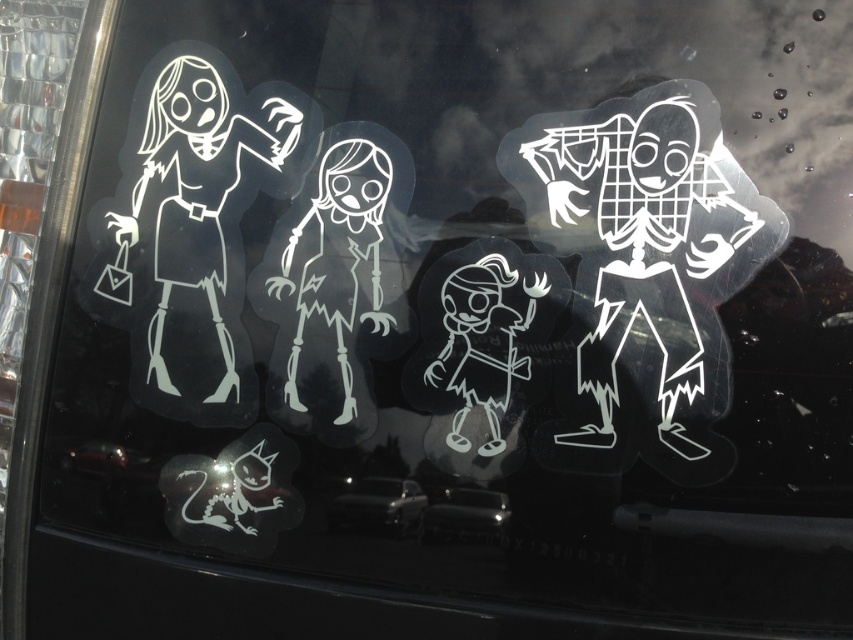
Between transparent plastic figure at right and transparent plastic car at lower center, which one is positioned lower?

Positioned lower is transparent plastic car at lower center.

What do you see at coordinates (646, 264) in the screenshot? I see `transparent plastic figure at right` at bounding box center [646, 264].

Between point (772, 234) and point (380, 477), which one is positioned behind?

The point (380, 477) is more distant.

I want to click on transparent plastic figure at right, so click(x=646, y=264).

Does transparent plastic figure at right appear on the right side of white matte skeleton at center?

Yes, transparent plastic figure at right is to the right of white matte skeleton at center.

Is transparent plastic figure at right to the left of white matte skeleton at center from the viewer's perspective?

No, transparent plastic figure at right is not to the left of white matte skeleton at center.

Is point (566, 246) positioned before point (492, 275)?

That is True.

Locate an element on the screen. transparent plastic figure at right is located at coordinates (646, 264).

Can you confirm if white matte skeleton at center is positioned above black glossy car at center?

Correct, white matte skeleton at center is located above black glossy car at center.

Between point (492, 384) and point (454, 500), which one is positioned in front?

Point (492, 384) is in front.

At what (x,y) coordinates should I click in order to perform the action: click on white matte skeleton at center. Please return your answer as a coordinate pair (x, y). Looking at the image, I should click on (485, 342).